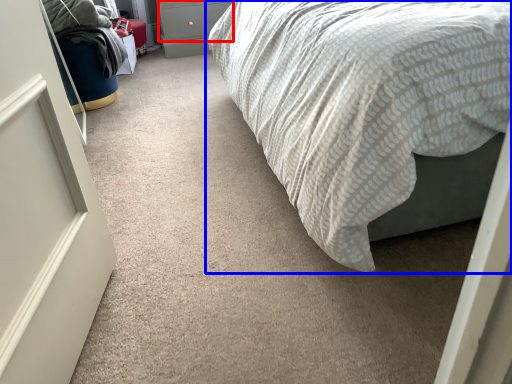
Question: Which of the following is the farthest to the observer, drawer (highlighted by a red box) or bed (highlighted by a blue box)?

Choices:
 (A) drawer
 (B) bed

Answer: (A)